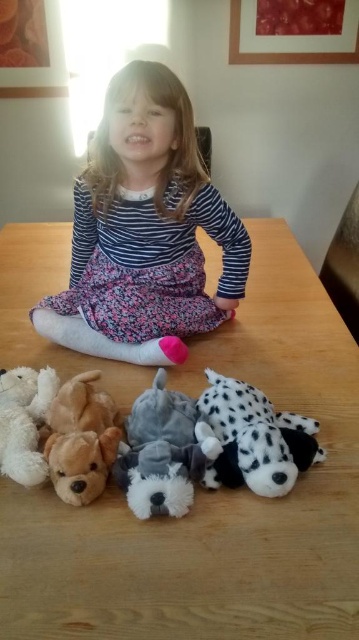
Question: Does wooden table at center appear on the right side of striped fabric at center?

Choices:
 (A) no
 (B) yes

Answer: (B)

Question: Can you confirm if striped fabric at center is positioned above fluffy gray dog at lower center?

Choices:
 (A) yes
 (B) no

Answer: (A)

Question: Which of the following is the closest to the observer?

Choices:
 (A) (146, 438)
 (B) (248, 422)
 (C) (98, 285)
 (D) (145, 428)

Answer: (B)

Question: Does wooden table at center appear on the right side of spotted plush dog at lower center?

Choices:
 (A) yes
 (B) no

Answer: (B)

Question: Which point is farther from the camera taking this photo?

Choices:
 (A) (170, 484)
 (B) (180, 497)

Answer: (B)

Question: Which of the following is the closest to the observer?

Choices:
 (A) (277, 440)
 (B) (16, 624)

Answer: (B)